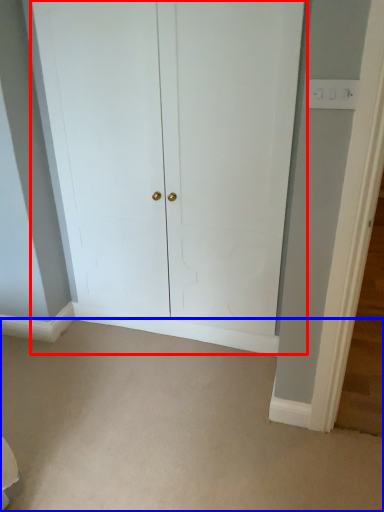
Question: Which object is closer to the camera taking this photo, door (highlighted by a red box) or plain (highlighted by a blue box)?

Choices:
 (A) door
 (B) plain

Answer: (B)